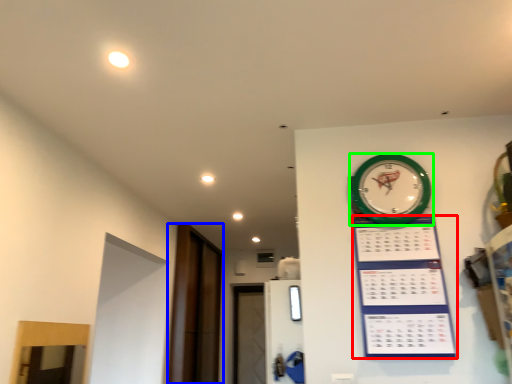
Question: Which object is positioned closest to bulletin board (highlighted by a red box)? Select from glass door (highlighted by a blue box) and wall clock (highlighted by a green box).

Choices:
 (A) glass door
 (B) wall clock

Answer: (B)